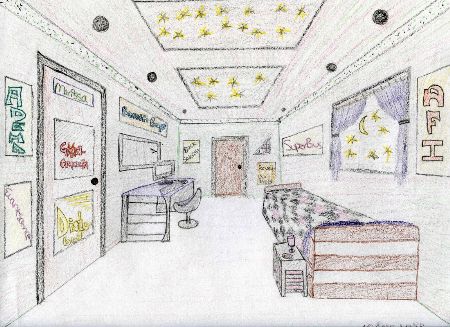
This screenshot has width=450, height=327. In order to click on window in this screenshot , I will do `click(374, 144)`.